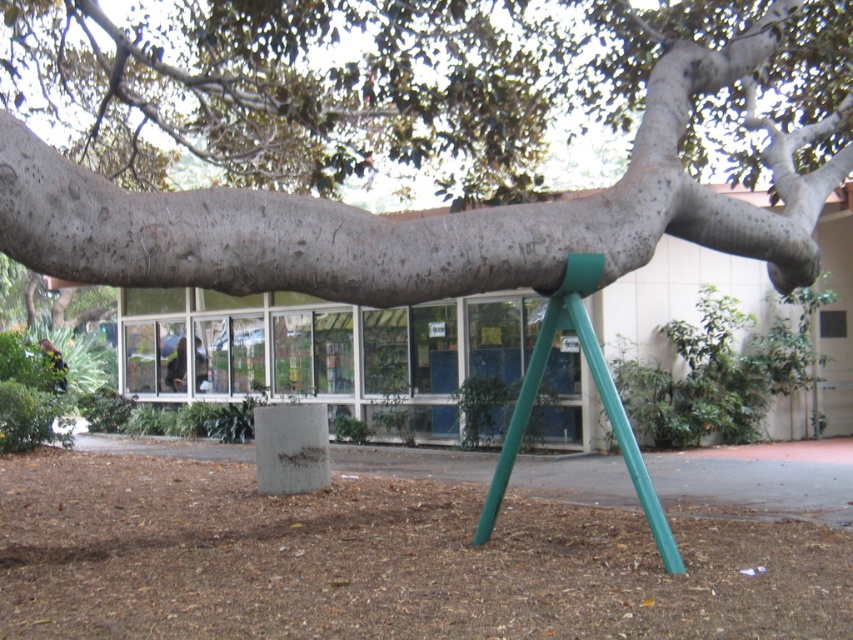
Can you confirm if smooth gray bark at center is positioned to the right of green matte tripod at center?

Incorrect, smooth gray bark at center is not on the right side of green matte tripod at center.

Between smooth gray bark at center and green matte tripod at center, which one has less height?

green matte tripod at center is shorter.

Where is `smooth gray bark at center`? smooth gray bark at center is located at coordinates (422, 136).